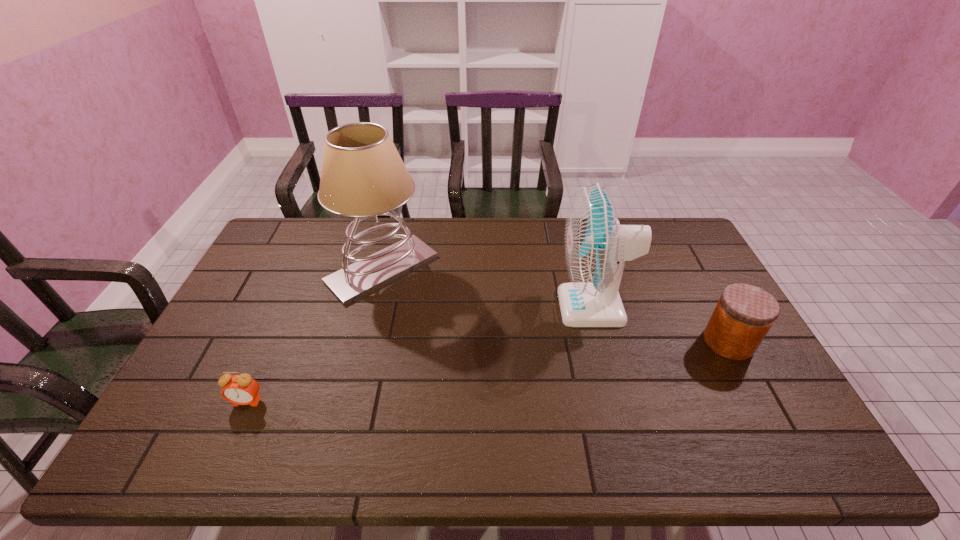
Find the location of a particular element. The image size is (960, 540). the tallest object is located at coordinates (363, 175).

Locate an element on the screen. This screenshot has height=540, width=960. the second object from left to right is located at coordinates (363, 175).

In order to click on the second object from right to left in this screenshot , I will do `click(596, 246)`.

At what (x,y) coordinates should I click in order to perform the action: click on the third shortest object. Please return your answer as a coordinate pair (x, y). The height and width of the screenshot is (540, 960). Looking at the image, I should click on (596, 246).

What are the coordinates of `jar` in the screenshot? It's located at (744, 314).

Where is `the rightmost object`? the rightmost object is located at coordinates (x=744, y=314).

The width and height of the screenshot is (960, 540). What are the coordinates of `the leftmost object` in the screenshot? It's located at (239, 389).

You are a GUI agent. You are given a task and a screenshot of the screen. Output one action in this format:
    pyautogui.click(x=<x>, y=<y>)
    Task: Click on the alarm clock
    
    Given the screenshot: What is the action you would take?
    coord(239,389)

Locate an element on the screen. vacant area located on the front of the table lamp is located at coordinates (343, 426).

Where is `free region located 0.290m in front of the second object from right to left to face the airflow`? The height and width of the screenshot is (540, 960). free region located 0.290m in front of the second object from right to left to face the airflow is located at coordinates (464, 307).